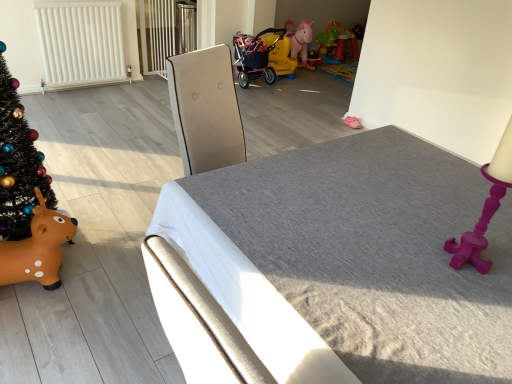
Question: Are yellow plastic stroller at center, the third toy positioned from the top, and brown rubber reindeer at lower left, which is counted as the 1th toy, starting from the front, located far from each other?

Choices:
 (A) no
 (B) yes

Answer: (B)

Question: Would you say brown rubber reindeer at lower left, the 1th toy positioned from the left, is part of yellow plastic stroller at center, marked as the second toy in a bottom-to-top arrangement,'s contents?

Choices:
 (A) no
 (B) yes

Answer: (A)

Question: Is yellow plastic stroller at center, the third toy positioned from the top, at the right side of brown rubber reindeer at lower left, which is counted as the 1th toy, starting from the front?

Choices:
 (A) yes
 (B) no

Answer: (A)

Question: Is yellow plastic stroller at center, marked as the second toy in a bottom-to-top arrangement, thinner than brown rubber reindeer at lower left, the 1th toy positioned from the left?

Choices:
 (A) no
 (B) yes

Answer: (A)

Question: Can you confirm if yellow plastic stroller at center, marked as the second toy in a bottom-to-top arrangement, is smaller than brown rubber reindeer at lower left, placed as the 1th toy when sorted from bottom to top?

Choices:
 (A) yes
 (B) no

Answer: (B)

Question: From the image's perspective, is yellow plastic stroller at center, the third toy when ordered from right to left, below brown rubber reindeer at lower left, which is counted as the 1th toy, starting from the front?

Choices:
 (A) yes
 (B) no

Answer: (B)

Question: Can you confirm if textured gray mattress at center is smaller than brown rubber reindeer at lower left, placed as the 1th toy when sorted from bottom to top?

Choices:
 (A) no
 (B) yes

Answer: (A)

Question: Considering the relative sizes of textured gray mattress at center and brown rubber reindeer at lower left, the fourth toy from the top, in the image provided, is textured gray mattress at center taller than brown rubber reindeer at lower left, the fourth toy from the top,?

Choices:
 (A) yes
 (B) no

Answer: (A)

Question: Is textured gray mattress at center in contact with brown rubber reindeer at lower left, the 1th toy positioned from the left?

Choices:
 (A) yes
 (B) no

Answer: (B)

Question: Is brown rubber reindeer at lower left, the 1th toy positioned from the left, at the back of textured gray mattress at center?

Choices:
 (A) no
 (B) yes

Answer: (A)

Question: Is textured gray mattress at center thinner than brown rubber reindeer at lower left, placed as the 1th toy when sorted from bottom to top?

Choices:
 (A) no
 (B) yes

Answer: (A)

Question: From a real-world perspective, is textured gray mattress at center on brown rubber reindeer at lower left, which is counted as the fourth toy, starting from the right?

Choices:
 (A) no
 (B) yes

Answer: (B)

Question: Does yellow plastic stroller at center, the 3th toy from the back, touch textured gray mattress at center?

Choices:
 (A) no
 (B) yes

Answer: (A)